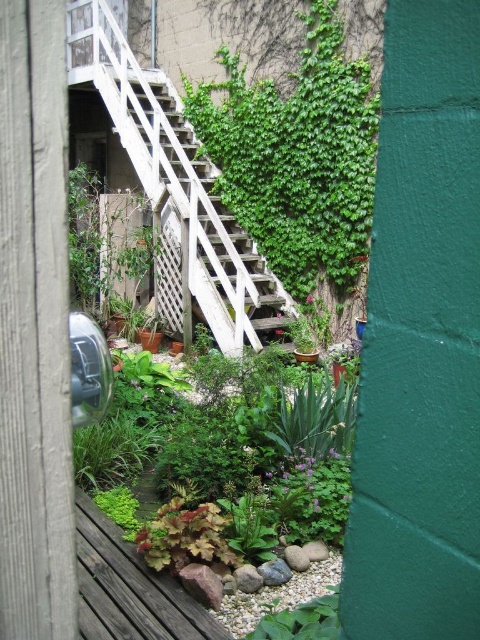
Question: Is leathery green leaf at center wider than green leafy plant at lower center?

Choices:
 (A) yes
 (B) no

Answer: (A)

Question: Does wooden stairs at center come in front of green leafy plant at lower center?

Choices:
 (A) no
 (B) yes

Answer: (A)

Question: Which point is farther from the camera taking this photo?

Choices:
 (A) (147, 72)
 (B) (168, 540)

Answer: (A)

Question: Which point is farther from the camera taking this photo?

Choices:
 (A) (212, 532)
 (B) (211, 246)
 (C) (336, 634)

Answer: (B)

Question: Can you confirm if wooden stairs at center is bigger than leathery green leaf at center?

Choices:
 (A) no
 (B) yes

Answer: (B)

Question: Which object is farther from the camera taking this photo?

Choices:
 (A) wooden stairs at center
 (B) leathery green leaf at center
 (C) green leafy plant at lower center

Answer: (A)